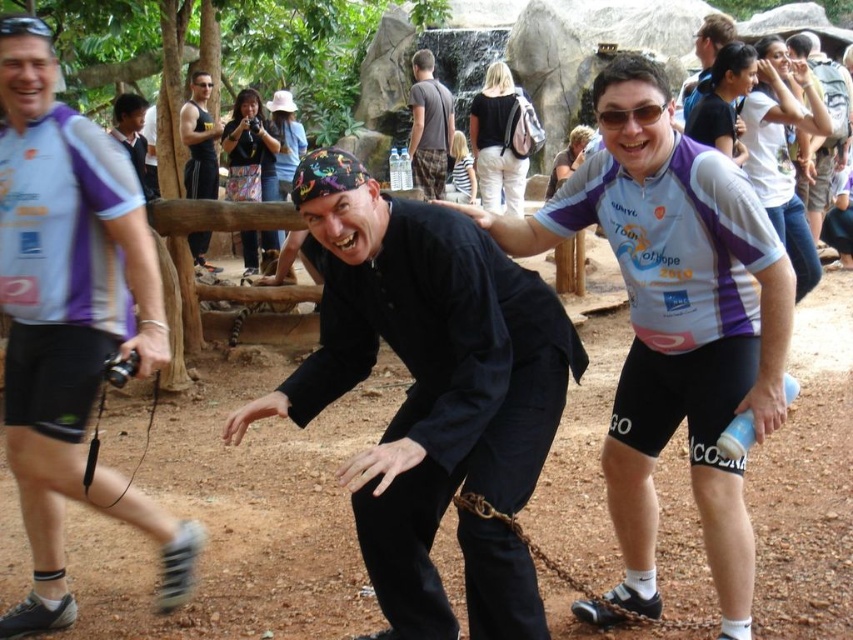
Question: From the image, what is the correct spatial relationship of matte black hat at center in relation to dark blue shirt at center?

Choices:
 (A) right
 (B) left

Answer: (A)

Question: Among these points, which one is nearest to the camera?

Choices:
 (A) (183, 131)
 (B) (601, 125)
 (C) (111, 129)
 (D) (190, 84)

Answer: (B)

Question: Which point appears closest to the camera in this image?

Choices:
 (A) (410, 634)
 (B) (468, 202)

Answer: (A)

Question: Is matte black shirt at upper right above dark blue shirt at center?

Choices:
 (A) yes
 (B) no

Answer: (B)

Question: Is purple/white cycling jersey at center to the right of sunglasses at center from the viewer's perspective?

Choices:
 (A) no
 (B) yes

Answer: (B)

Question: Estimate the real-world distances between objects in this image. Which object is farther from the black rubber goggles at upper left?

Choices:
 (A) black plastic goggles at upper center
 (B) white matte cycling jersey at left
 (C) sunglasses at center
 (D) matte purple jersey at center

Answer: (D)